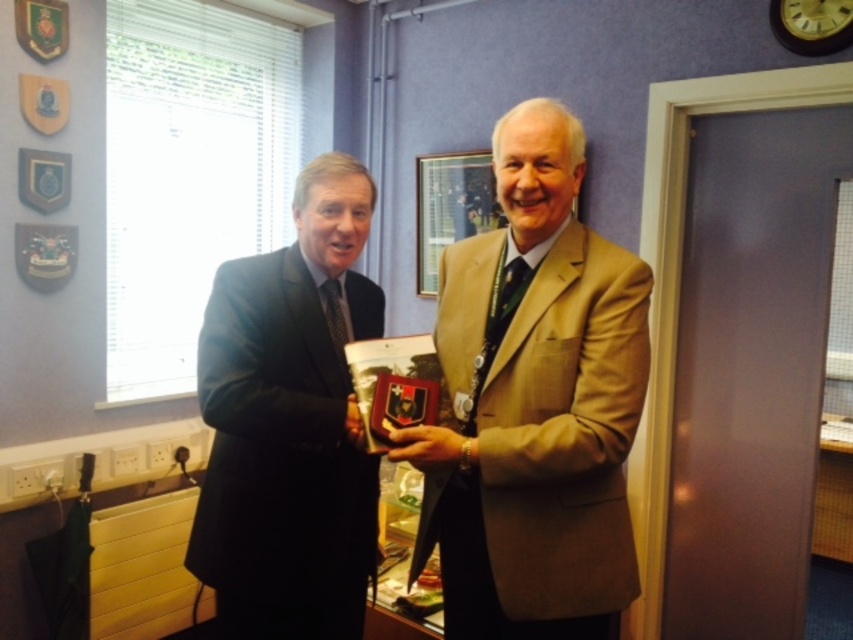
Is point (498, 618) in front of point (234, 596)?

Yes.

Can you confirm if light brown textured suit at center is smaller than dark blue suit at left?

Incorrect, light brown textured suit at center is not smaller in size than dark blue suit at left.

Is point (531, 182) positioned before point (257, 512)?

Yes, point (531, 182) is in front of point (257, 512).

Identify the location of light brown textured suit at center. The height and width of the screenshot is (640, 853). (534, 404).